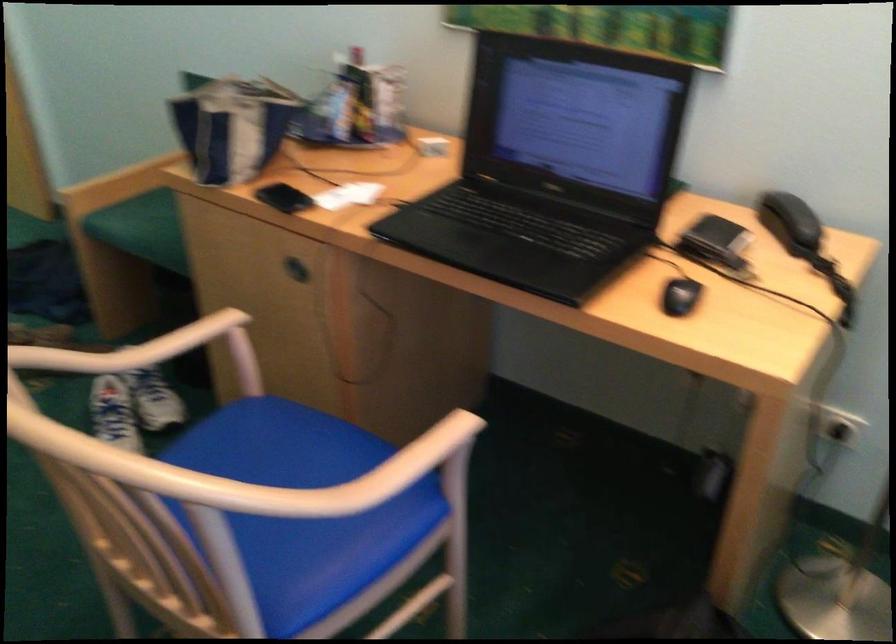
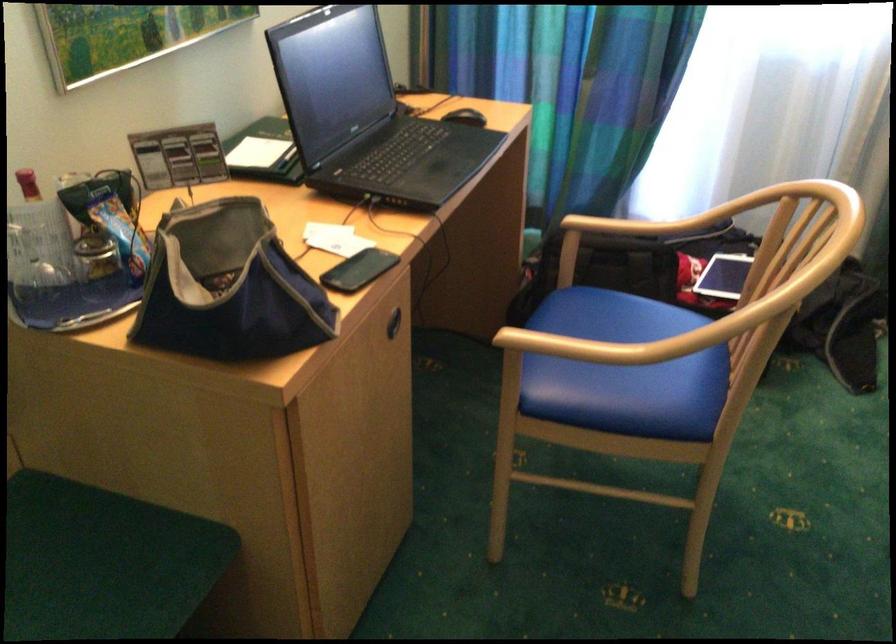
Find the pixel in the second image that matches the point at 235,471 in the first image.

(624, 370)